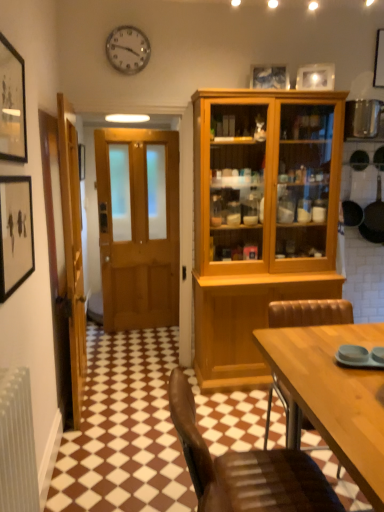
The height and width of the screenshot is (512, 384). I want to click on free space to the right of wooden door at left, which ranks as the second door in right-to-left order, so click(x=140, y=400).